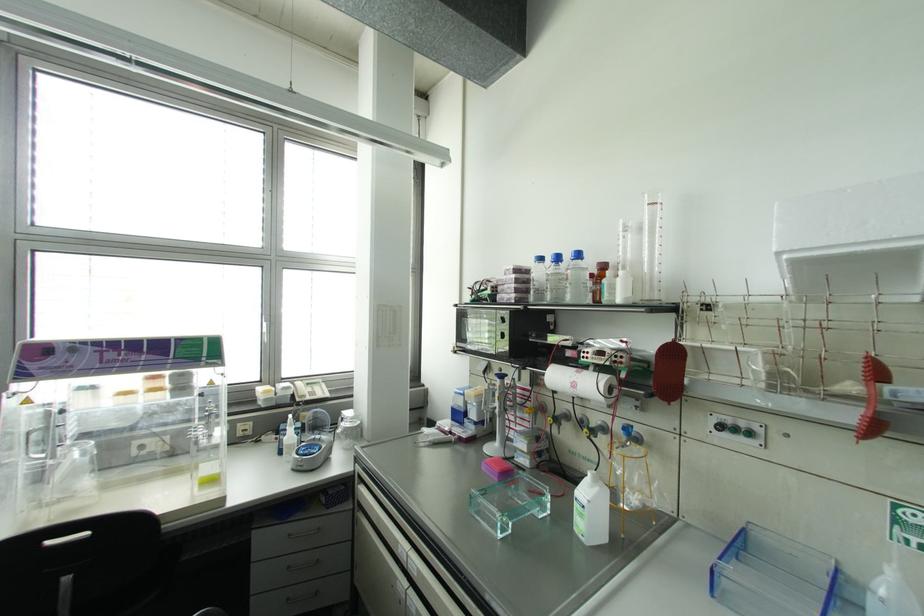
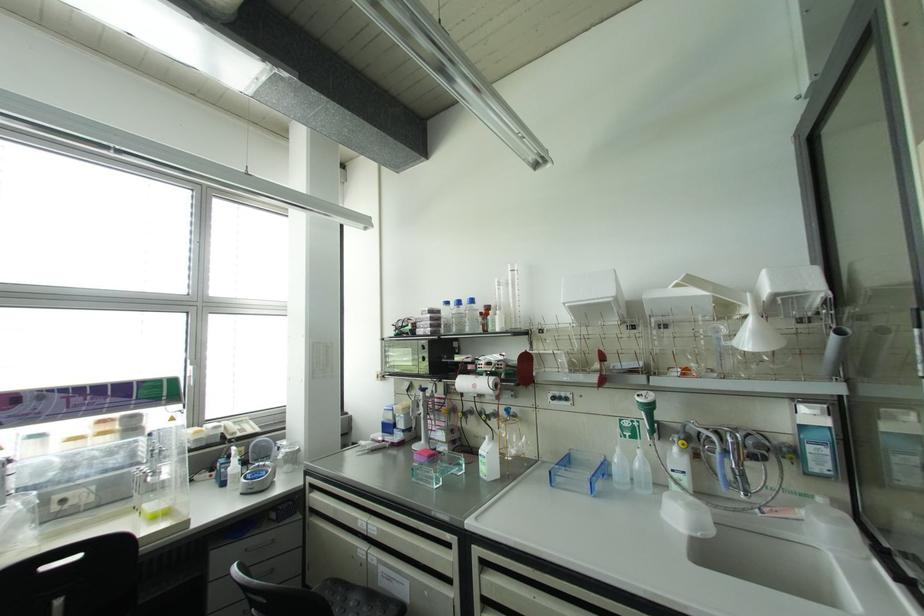
Find the pixel in the second image that matches the point at 263,323 in the first image.

(189, 368)